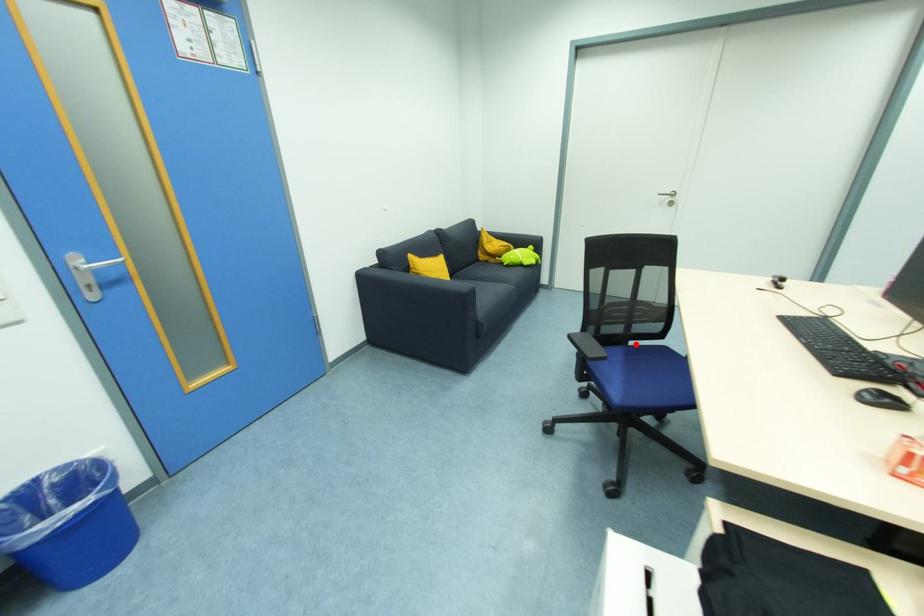
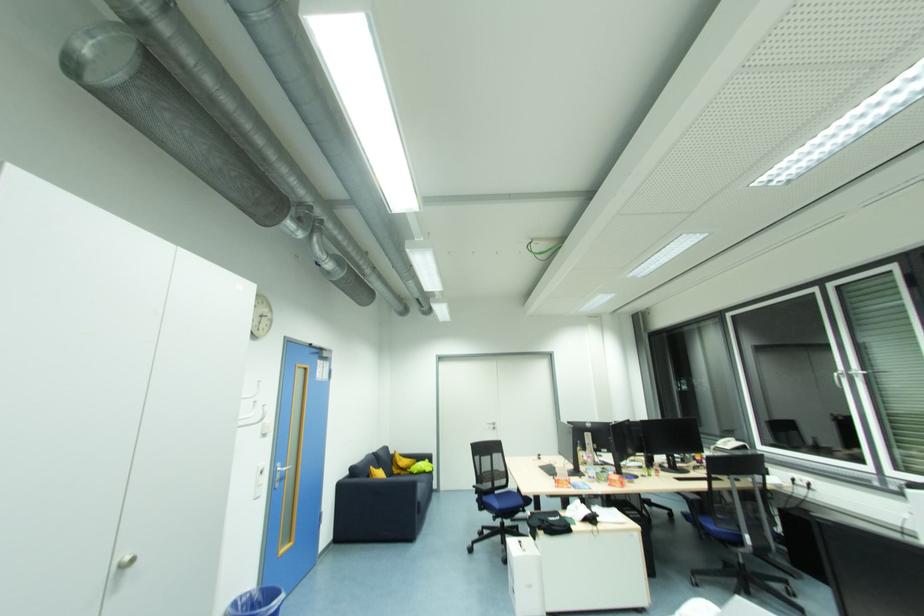
Question: A red point is marked in image1. In image2, is the corresponding 3D point closer to the camera or farther? Reply with the corresponding letter.

Choices:
 (A) The corresponding 3D point is closer.
 (B) The corresponding 3D point is farther.

Answer: (B)